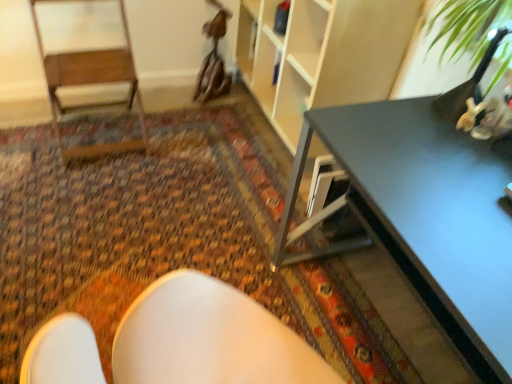
Question: From the image's perspective, does carpeted floor at center appear lower than wooden armchair at left?

Choices:
 (A) no
 (B) yes

Answer: (B)

Question: Is carpeted floor at center smaller than wooden armchair at left?

Choices:
 (A) no
 (B) yes

Answer: (B)

Question: Is carpeted floor at center wider than wooden armchair at left?

Choices:
 (A) yes
 (B) no

Answer: (A)

Question: From a real-world perspective, does carpeted floor at center sit lower than wooden armchair at left?

Choices:
 (A) yes
 (B) no

Answer: (A)

Question: Is carpeted floor at center positioned before wooden armchair at left?

Choices:
 (A) yes
 (B) no

Answer: (A)

Question: Is matte black table at right in front of or behind carpeted floor at center in the image?

Choices:
 (A) behind
 (B) front

Answer: (B)

Question: In the image, is matte black table at right on the left side or the right side of carpeted floor at center?

Choices:
 (A) right
 (B) left

Answer: (A)

Question: Based on their sizes in the image, would you say matte black table at right is bigger or smaller than carpeted floor at center?

Choices:
 (A) big
 (B) small

Answer: (A)

Question: Considering the positions of point (446, 279) and point (49, 304), is point (446, 279) closer or farther from the camera than point (49, 304)?

Choices:
 (A) closer
 (B) farther

Answer: (A)

Question: Based on their sizes in the image, would you say wooden armchair at left is bigger or smaller than matte black table at right?

Choices:
 (A) small
 (B) big

Answer: (A)

Question: From a real-world perspective, relative to matte black table at right, is wooden armchair at left vertically above or below?

Choices:
 (A) below
 (B) above

Answer: (B)

Question: From the image's perspective, relative to matte black table at right, is wooden armchair at left above or below?

Choices:
 (A) below
 (B) above

Answer: (B)

Question: In the image, is wooden armchair at left on the left side or the right side of matte black table at right?

Choices:
 (A) right
 (B) left

Answer: (B)

Question: From the image's perspective, is matte black table at right above or below wooden armchair at left?

Choices:
 (A) below
 (B) above

Answer: (A)

Question: Choose the correct answer: Is matte black table at right inside wooden armchair at left or outside it?

Choices:
 (A) outside
 (B) inside

Answer: (A)